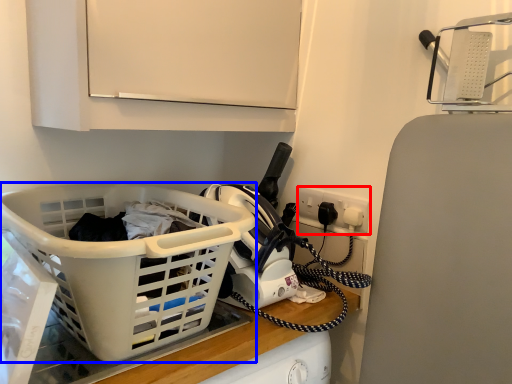
Question: Among these objects, which one is farthest to the camera, electric outlet (highlighted by a red box) or basket (highlighted by a blue box)?

Choices:
 (A) electric outlet
 (B) basket

Answer: (A)